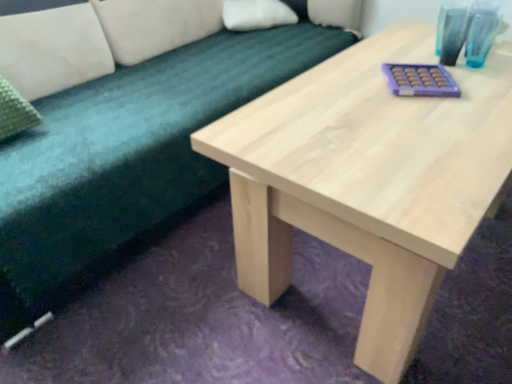
The image size is (512, 384). In order to click on teal glass at upper right in this screenshot , I will do `click(481, 31)`.

What is the approximate width of teal glass at upper right?

It is 3.94 inches.

Identify the location of white soft pillow at upper center. The image size is (512, 384). (256, 14).

Locate an element on the screen. soft green fabric couch at upper left is located at coordinates (134, 153).

This screenshot has width=512, height=384. In order to click on teal glass at upper right in this screenshot , I will do pyautogui.click(x=481, y=31).

From their relative heights in the image, would you say white soft pillow at upper center is taller or shorter than clear glass vase at upper right?

Considering their sizes, white soft pillow at upper center has less height than clear glass vase at upper right.

Based on the photo, considering the relative positions of white soft pillow at upper center and clear glass vase at upper right in the image provided, is white soft pillow at upper center to the right of clear glass vase at upper right from the viewer's perspective?

In fact, white soft pillow at upper center is to the left of clear glass vase at upper right.

Where is `pillow on the left of clear glass vase at upper right`? The width and height of the screenshot is (512, 384). pillow on the left of clear glass vase at upper right is located at coordinates (256, 14).

Looking at their sizes, would you say white soft pillow at upper center is wider or thinner than clear glass vase at upper right?

In the image, white soft pillow at upper center appears to be wider than clear glass vase at upper right.

Considering their positions, is natural wood table at center located in front of or behind teal glass at upper right?

natural wood table at center is in front of teal glass at upper right.

Between natural wood table at center and teal glass at upper right, which one appears on the left side from the viewer's perspective?

natural wood table at center.

What's the angular difference between natural wood table at center and teal glass at upper right's facing directions?

The angular difference between natural wood table at center and teal glass at upper right is 1.52 degrees.

Is natural wood table at center facing away from teal glass at upper right?

natural wood table at center does not have its back to teal glass at upper right.

Considering the sizes of clear glass vase at upper right and soft green fabric couch at upper left in the image, is clear glass vase at upper right taller or shorter than soft green fabric couch at upper left?

Considering their sizes, clear glass vase at upper right has less height than soft green fabric couch at upper left.

Is clear glass vase at upper right thinner than soft green fabric couch at upper left?

Indeed, clear glass vase at upper right has a lesser width compared to soft green fabric couch at upper left.

Measure the distance between clear glass vase at upper right and soft green fabric couch at upper left.

A distance of 36.78 inches exists between clear glass vase at upper right and soft green fabric couch at upper left.

Is clear glass vase at upper right spatially inside soft green fabric couch at upper left, or outside of it?

clear glass vase at upper right is located beyond the bounds of soft green fabric couch at upper left.

Which is in front, point (1, 197) or point (474, 8)?

The point (1, 197) is in front.

In the scene shown: Considering the sizes of objects soft green fabric couch at upper left and teal glass at upper right in the image provided, who is wider, soft green fabric couch at upper left or teal glass at upper right?

A: Wider between the two is soft green fabric couch at upper left.

Based on their sizes in the image, would you say soft green fabric couch at upper left is bigger or smaller than teal glass at upper right?

In the image, soft green fabric couch at upper left appears to be larger than teal glass at upper right.

How different are the orientations of teal glass at upper right and clear glass vase at upper right in degrees?

The facing directions of teal glass at upper right and clear glass vase at upper right are 0.000988 degrees apart.

Considering their positions, is teal glass at upper right located in front of or behind clear glass vase at upper right?

Clearly, teal glass at upper right is behind clear glass vase at upper right.

Identify the location of glass vase directly beneath the teal glass at upper right (from a real-world perspective). The image size is (512, 384). (451, 31).

Is the surface of soft green fabric couch at upper left in direct contact with natural wood table at center?

No, soft green fabric couch at upper left is not making contact with natural wood table at center.

Does soft green fabric couch at upper left have a lesser width compared to natural wood table at center?

Yes.

Is soft green fabric couch at upper left turned away from natural wood table at center?

soft green fabric couch at upper left is not turned away from natural wood table at center.

From the image's perspective, is soft green fabric couch at upper left below natural wood table at center?

Incorrect, from the image's perspective, soft green fabric couch at upper left is higher than natural wood table at center.

Does soft green fabric couch at upper left have a smaller size compared to clear glass vase at upper right?

No, soft green fabric couch at upper left is not smaller than clear glass vase at upper right.

Is soft green fabric couch at upper left looking in the opposite direction of clear glass vase at upper right?

That's not correct — soft green fabric couch at upper left is not looking away from clear glass vase at upper right.

What's the angular difference between soft green fabric couch at upper left and clear glass vase at upper right's facing directions?

There is a 1.16-degree angle between the facing directions of soft green fabric couch at upper left and clear glass vase at upper right.

In the scene shown: From a real-world perspective, is soft green fabric couch at upper left positioned above or below clear glass vase at upper right?

soft green fabric couch at upper left is below clear glass vase at upper right.

Find the location of a particular element. glass vase in front of the white soft pillow at upper center is located at coordinates (451, 31).

Locate an element on the screen. The width and height of the screenshot is (512, 384). table below the teal glass at upper right (from the image's perspective) is located at coordinates (368, 179).

Which object lies nearer to the anchor point clear glass vase at upper right, natural wood table at center or teal glass at upper right?

teal glass at upper right is positioned closer to the anchor clear glass vase at upper right.

Which object lies nearer to the anchor point natural wood table at center, white soft pillow at upper center or soft green fabric couch at upper left?

Based on the image, soft green fabric couch at upper left appears to be nearer to natural wood table at center.

Considering their positions, is natural wood table at center positioned closer to soft green fabric couch at upper left than teal glass at upper right?

natural wood table at center is positioned closer to the anchor soft green fabric couch at upper left.

Considering their positions, is soft green fabric couch at upper left positioned closer to white soft pillow at upper center than clear glass vase at upper right?

Based on the image, soft green fabric couch at upper left appears to be nearer to white soft pillow at upper center.

From the image, which object appears to be nearer to natural wood table at center, teal glass at upper right or clear glass vase at upper right?

Based on the image, clear glass vase at upper right appears to be nearer to natural wood table at center.

Based on their spatial positions, is white soft pillow at upper center or clear glass vase at upper right closer to teal glass at upper right?

clear glass vase at upper right.

Estimate the real-world distances between objects in this image. Which object is further from teal glass at upper right, natural wood table at center or soft green fabric couch at upper left?

soft green fabric couch at upper left lies further to teal glass at upper right than the other object.

When comparing their distances from white soft pillow at upper center, does teal glass at upper right or soft green fabric couch at upper left seem further?

teal glass at upper right is further to white soft pillow at upper center.

I want to click on glass vase between natural wood table at center and white soft pillow at upper center along the z-axis, so click(451, 31).

The width and height of the screenshot is (512, 384). Identify the location of table located between soft green fabric couch at upper left and teal glass at upper right in the left-right direction. (368, 179).

Locate an element on the screen. The image size is (512, 384). glass vase between soft green fabric couch at upper left and teal glass at upper right in the horizontal direction is located at coordinates (451, 31).

You are a GUI agent. You are given a task and a screenshot of the screen. Output one action in this format:
    pyautogui.click(x=<x>, y=<y>)
    Task: Click on the table between soft green fabric couch at upper left and clear glass vase at upper right
    The image size is (512, 384).
    Given the screenshot: What is the action you would take?
    click(368, 179)